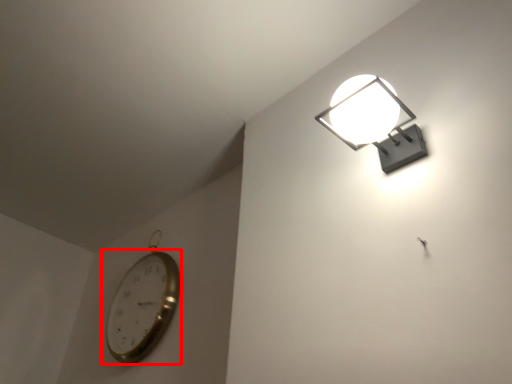
Question: In this image, where is wall clock (annotated by the red box) located relative to lamp?

Choices:
 (A) left
 (B) right

Answer: (A)